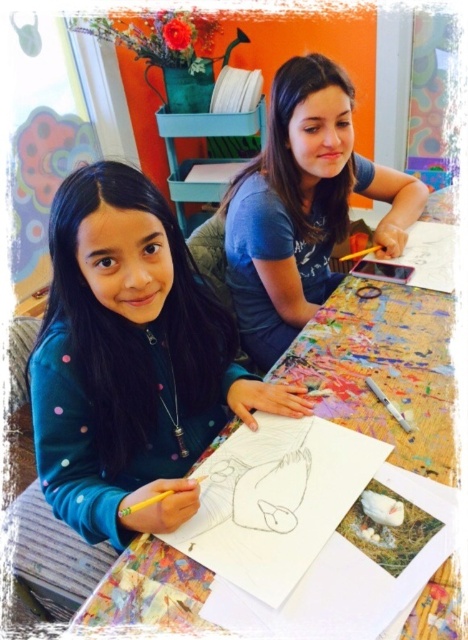
Is point (210, 368) closer to camera compared to point (117, 568)?

No, it is behind (117, 568).

Can you confirm if teal fleece jacket at lower left is taller than wooden table at center?

Yes.

Is point (204, 312) farther from camera compared to point (401, 408)?

Yes, it is behind point (401, 408).

Find the location of a particular element. This screenshot has width=468, height=640. teal fleece jacket at lower left is located at coordinates (131, 360).

Does wooden table at center have a larger size compared to blue cotton shirt at upper center?

No, wooden table at center is not bigger than blue cotton shirt at upper center.

Who is taller, wooden table at center or blue cotton shirt at upper center?

blue cotton shirt at upper center

Between point (429, 212) and point (323, 154), which one is positioned in front?

Point (323, 154) is in front.

Identify the location of wooden table at center. This screenshot has width=468, height=640. (384, 369).

Does point (112, 461) lie in front of point (265, 252)?

Yes, point (112, 461) is in front of point (265, 252).

Who is higher up, teal fleece jacket at lower left or blue cotton shirt at upper center?

Positioned higher is blue cotton shirt at upper center.

The image size is (468, 640). Describe the element at coordinates (131, 360) in the screenshot. I see `teal fleece jacket at lower left` at that location.

The height and width of the screenshot is (640, 468). I want to click on teal fleece jacket at lower left, so click(131, 360).